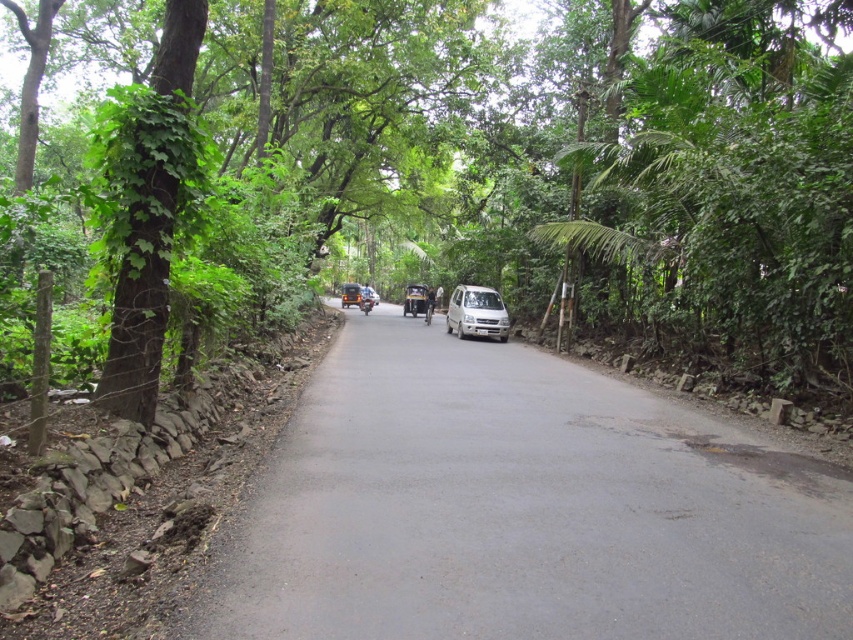
Which is below, green leafy tree at left or blue metallic motorcycle at center?

green leafy tree at left is below.

Who is more forward, (165, 168) or (368, 305)?

Point (165, 168) is more forward.

This screenshot has height=640, width=853. Describe the element at coordinates (149, 216) in the screenshot. I see `green leafy tree at left` at that location.

I want to click on green leafy tree at left, so click(x=149, y=216).

Does metallic silver auto-rickshaw at center appear under blue metallic motorcycle at center?

Yes.

Which of these two, metallic silver auto-rickshaw at center or blue metallic motorcycle at center, stands taller?

metallic silver auto-rickshaw at center is taller.

This screenshot has height=640, width=853. Identify the location of metallic silver auto-rickshaw at center. (x=416, y=300).

You are a GUI agent. You are given a task and a screenshot of the screen. Output one action in this format:
    pyautogui.click(x=<x>, y=<y>)
    Task: Click on the metallic silver auto-rickshaw at center
    This screenshot has width=853, height=640.
    Given the screenshot: What is the action you would take?
    pyautogui.click(x=416, y=300)

Who is shorter, smooth asphalt road at center or green leafy tree at right?

Standing shorter between the two is smooth asphalt road at center.

Does smooth asphalt road at center appear over green leafy tree at right?

No, smooth asphalt road at center is not above green leafy tree at right.

You are a GUI agent. You are given a task and a screenshot of the screen. Output one action in this format:
    pyautogui.click(x=<x>, y=<y>)
    Task: Click on the smooth asphalt road at center
    This screenshot has width=853, height=640.
    Given the screenshot: What is the action you would take?
    click(x=520, y=509)